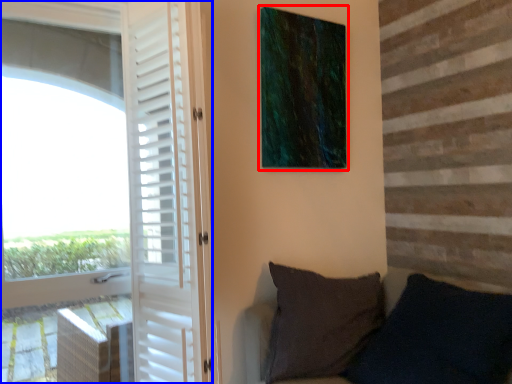
Question: Which point is closer to the camera, picture frame (highlighted by a red box) or door (highlighted by a blue box)?

Choices:
 (A) picture frame
 (B) door

Answer: (B)